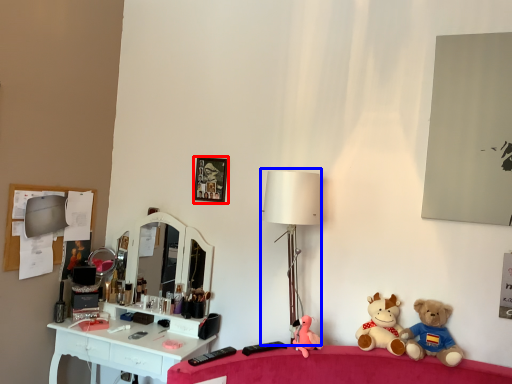
Question: Among these objects, which one is farthest to the camera, picture frame (highlighted by a red box) or table lamp (highlighted by a blue box)?

Choices:
 (A) picture frame
 (B) table lamp

Answer: (A)